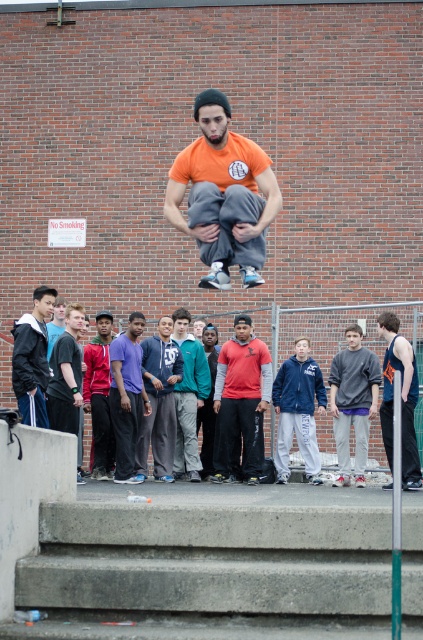
Which is in front, point (260, 448) or point (299, 419)?

Point (260, 448) is more forward.

Which of these two, red cotton hoodie at center or navy blue fleece jacket at center, stands taller?

Standing taller between the two is red cotton hoodie at center.

At what (x,y) coordinates should I click in order to perform the action: click on red cotton hoodie at center. Please return your answer as a coordinate pair (x, y). This screenshot has height=640, width=423. Looking at the image, I should click on (241, 401).

What are the coordinates of `red cotton hoodie at center` in the screenshot? It's located at (241, 401).

Between orange cotton t-shirt at center and dark gray pants at center, which one appears on the left side from the viewer's perspective?

From the viewer's perspective, orange cotton t-shirt at center appears more on the left side.

Image resolution: width=423 pixels, height=640 pixels. What are the coordinates of `orange cotton t-shirt at center` in the screenshot? It's located at (222, 195).

Does point (176, 355) come closer to viewer compared to point (11, 372)?

Yes, it is.

Does blue cotton hoodie at center come behind matte black jacket at lower left?

Yes, it is behind matte black jacket at lower left.

Locate an element on the screen. The image size is (423, 640). blue cotton hoodie at center is located at coordinates (159, 401).

You are a GUI agent. You are given a task and a screenshot of the screen. Output one action in this format:
    pyautogui.click(x=<x>, y=<y>)
    Task: Click on the blue cotton hoodie at center
    
    Given the screenshot: What is the action you would take?
    coord(159,401)